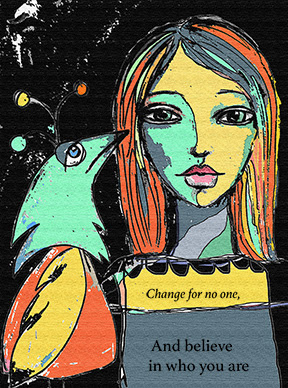
The width and height of the screenshot is (288, 388). What are the coordinates of `picture` in the screenshot? It's located at (184, 284).